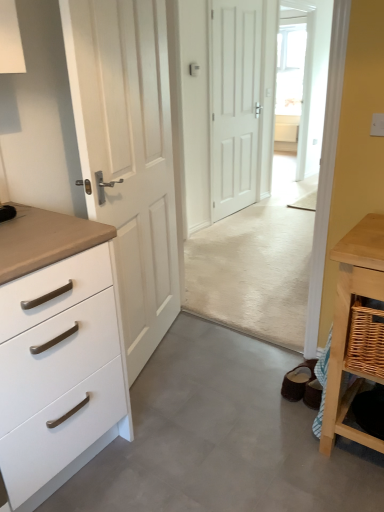
Locate an element on the screen. The image size is (384, 512). vacant space underneath white wood door at left, positioned as the second door in back-to-front order (from a real-world perspective) is located at coordinates (160, 349).